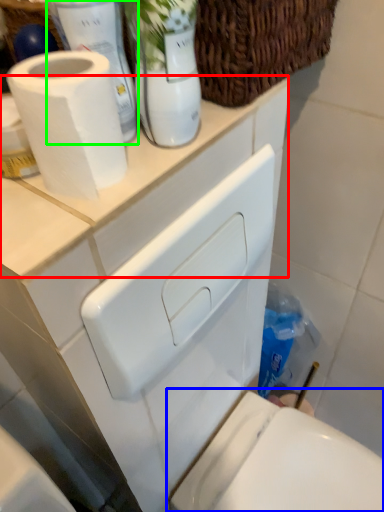
Question: Which object is positioned closest to counter top (highlighted by a red box)? Select from toilet (highlighted by a blue box) and bottle (highlighted by a green box).

Choices:
 (A) toilet
 (B) bottle

Answer: (B)